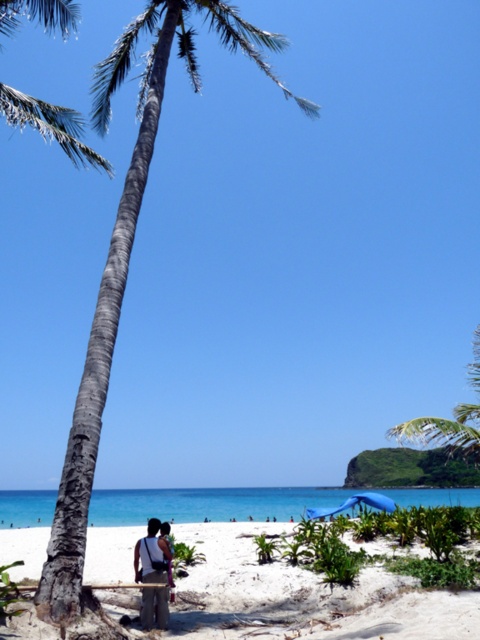
You are planning to set up a small picnic area on the beach. You have a dark gray fabric bag at lower center containing picnic items. Considering the gray bark palm tree at left, which object would be more suitable to use as a support for hanging the bag?

The gray bark palm tree at left is larger in size than the dark gray fabric bag at lower center, making it a more stable and suitable option for hanging the bag.

You are standing at the coordinates given in the Objects Description for the white sandy beach at lower center. What is the name of the location you are currently standing on?

You are standing on the white sandy beach at lower center.

You are standing on the beach and want to walk from the palm tree to the blue canopy tent. There are two points marked on the sand, point A at coordinates point A is point (x=217, y=605) and point B at coordinates point B is point (x=148, y=547). Which point is closer to you as you start walking from the palm tree towards the tent?

Point A at coordinates point A is point (x=217, y=605) is closer to you because it is further to the viewer than point B at coordinates point B is point (x=148, y=547).